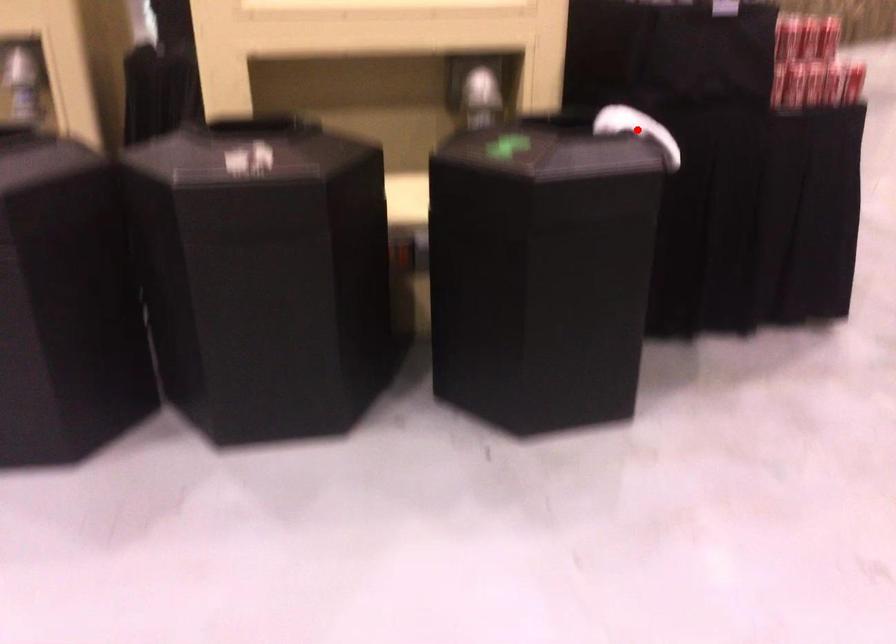
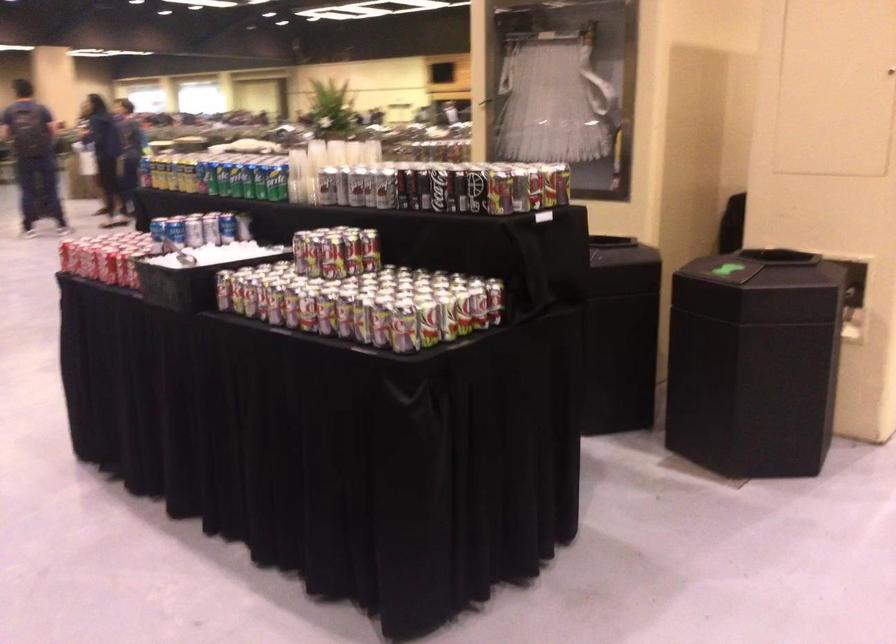
Question: I am providing you with two images of the same scene from different viewpoints. A red point is marked on the first image. Can you still see the location of the red point in image 2?

Choices:
 (A) Yes
 (B) No

Answer: (B)